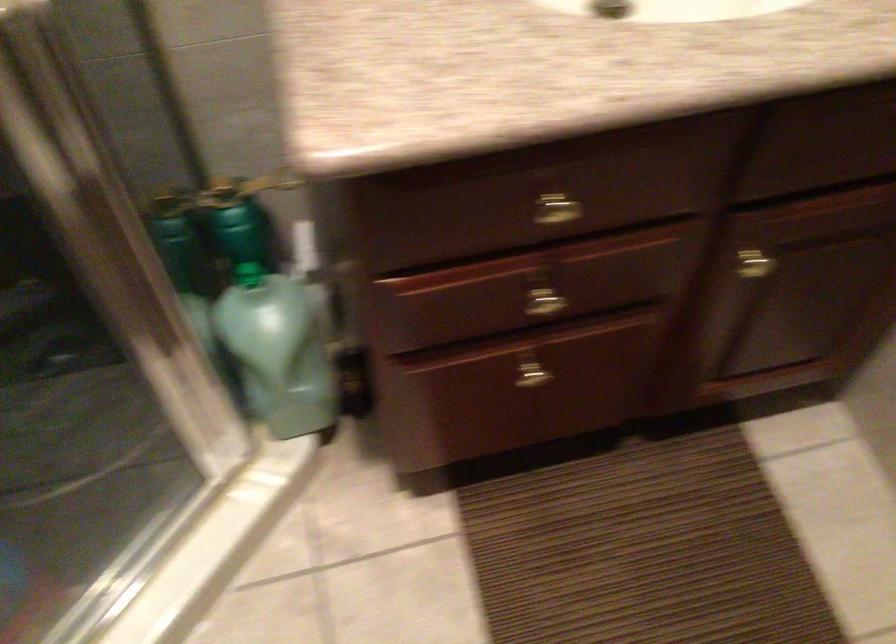
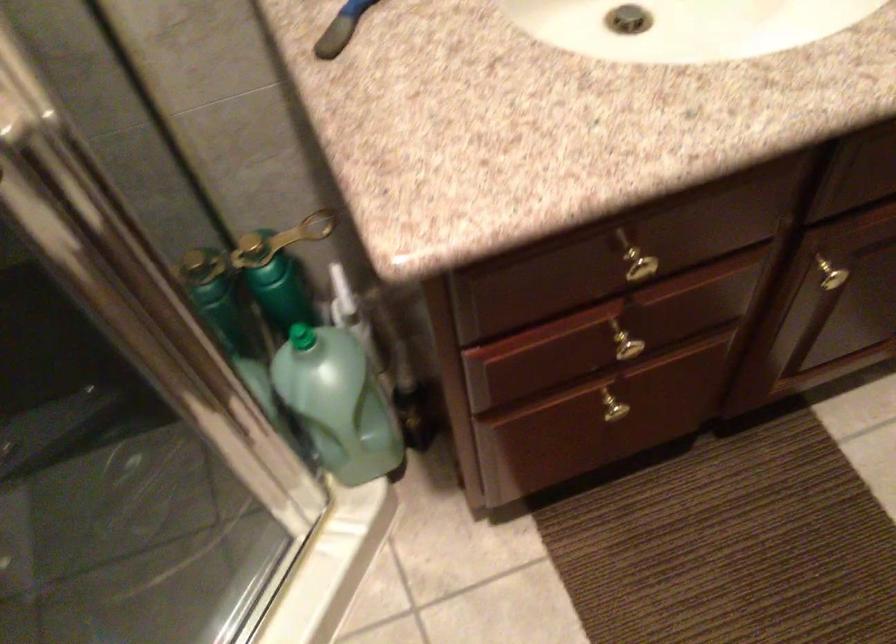
Locate, in the second image, the point that corresponds to point 531,377 in the first image.

(616, 411)